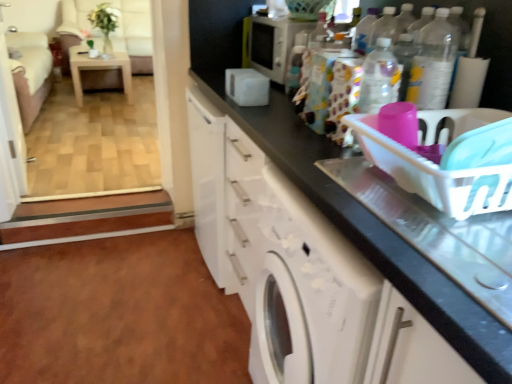
Identify the location of free location to the right of white glossy screen door at upper left. The width and height of the screenshot is (512, 384). (90, 170).